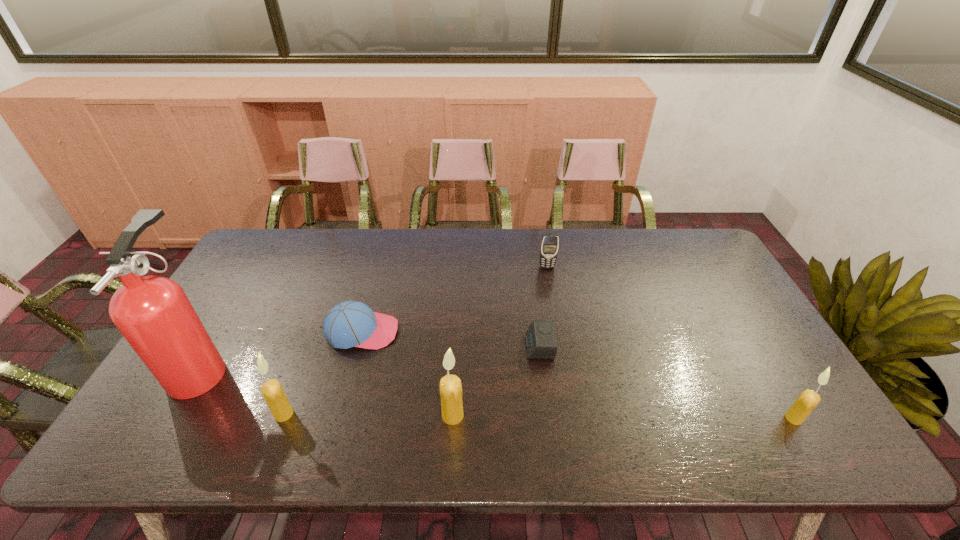
You are a GUI agent. You are given a task and a screenshot of the screen. Output one action in this format:
    pyautogui.click(x=<x>, y=<y>)
    Task: Click on the vacant area that lies between the alarm clock and the fourth object from left to right
    
    Given the screenshot: What is the action you would take?
    pyautogui.click(x=496, y=381)

Identify the location of free spot between the shortest candle and the baseball cap. Image resolution: width=960 pixels, height=540 pixels. (578, 375).

Identify the location of vacant area that lies between the fire extinguisher and the baseball cap. (282, 349).

At what (x,y) coordinates should I click in order to perform the action: click on the closest object to the shortest object. Please return your answer as a coordinate pair (x, y). The width and height of the screenshot is (960, 540). Looking at the image, I should click on (450, 385).

Choose which object is the sixth nearest neighbor to the farthest object. Please provide its 2D coordinates. Your answer should be formatted as a tuple, i.e. [(x, y)], where the tuple contains the x and y coordinates of a point satisfying the conditions above.

[(153, 313)]

This screenshot has width=960, height=540. Identify the location of candle that is the second nearest to the rightmost object. (272, 391).

Where is `the second closest candle to the fifth object from right to left`? Image resolution: width=960 pixels, height=540 pixels. the second closest candle to the fifth object from right to left is located at coordinates (450, 385).

Find the location of a particular element. This screenshot has height=540, width=960. free spot that satisfies the following two spatial constraints: 1. on the front-facing side of the fourth object from left to right; 2. on the right side of the second shortest object is located at coordinates (340, 415).

Image resolution: width=960 pixels, height=540 pixels. I want to click on free space that satisfies the following two spatial constraints: 1. on the front-facing side of the second shortest object; 2. on the right side of the second candle from left to right, so click(340, 415).

In order to click on free location that satisfies the following two spatial constraints: 1. on the front face of the rightmost object; 2. on the left side of the third shortest object in this screenshot , I will do click(574, 418).